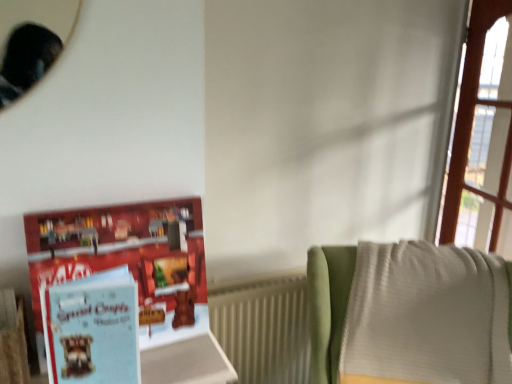
Question: Can you confirm if light blue paper book at left is wider than white ribbed radiator at lower right?

Choices:
 (A) no
 (B) yes

Answer: (B)

Question: Can you confirm if light blue paper book at left is bigger than white ribbed radiator at lower right?

Choices:
 (A) yes
 (B) no

Answer: (A)

Question: Would you say white ribbed radiator at lower right is part of light blue paper book at left's contents?

Choices:
 (A) no
 (B) yes

Answer: (A)

Question: Does light blue paper book at left have a smaller size compared to white ribbed radiator at lower right?

Choices:
 (A) yes
 (B) no

Answer: (B)

Question: From the image's perspective, is light blue paper book at left beneath white ribbed radiator at lower right?

Choices:
 (A) yes
 (B) no

Answer: (B)

Question: From a real-world perspective, relative to light blue paper at left, is white ribbed radiator at lower right vertically above or below?

Choices:
 (A) above
 (B) below

Answer: (B)

Question: From the image's perspective, relative to light blue paper at left, is white ribbed radiator at lower right above or below?

Choices:
 (A) above
 (B) below

Answer: (B)

Question: Does point (261, 299) appear closer or farther from the camera than point (50, 354)?

Choices:
 (A) farther
 (B) closer

Answer: (A)

Question: Is white ribbed radiator at lower right bigger or smaller than light blue paper at left?

Choices:
 (A) small
 (B) big

Answer: (B)

Question: Looking at their shapes, would you say light blue paper at left is wider or thinner than white textured blanket at right?

Choices:
 (A) wide
 (B) thin

Answer: (B)

Question: Visually, is light blue paper at left positioned to the left or to the right of white textured blanket at right?

Choices:
 (A) right
 (B) left

Answer: (B)

Question: Considering the positions of point tap(67, 322) and point tap(323, 294), is point tap(67, 322) closer or farther from the camera than point tap(323, 294)?

Choices:
 (A) farther
 (B) closer

Answer: (B)

Question: From the image's perspective, is light blue paper at left positioned above or below white textured blanket at right?

Choices:
 (A) below
 (B) above

Answer: (B)

Question: From a real-world perspective, relative to light blue paper book at left, is light blue paper at left vertically above or below?

Choices:
 (A) above
 (B) below

Answer: (B)

Question: In the image, is light blue paper at left positioned in front of or behind light blue paper book at left?

Choices:
 (A) behind
 (B) front

Answer: (B)